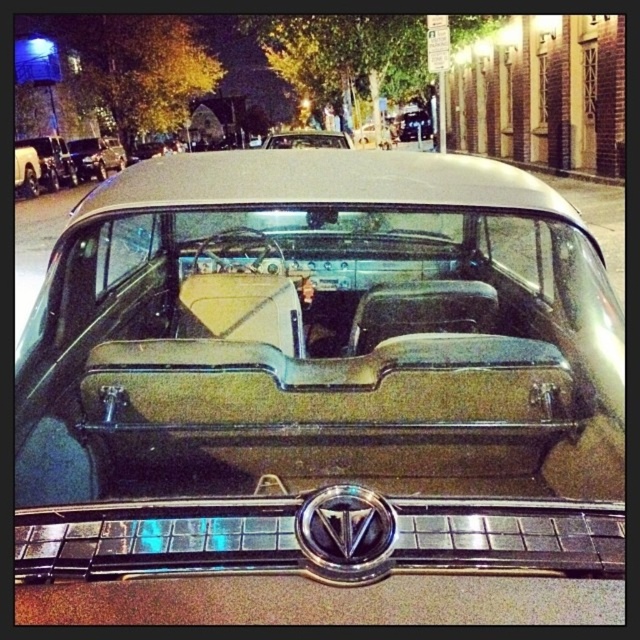
Question: Which of the following is the closest to the observer?

Choices:
 (A) (316, 145)
 (B) (310, 276)

Answer: (B)

Question: Where is metallic tan car at center located in relation to shiny beige leather car at center in the image?

Choices:
 (A) below
 (B) above

Answer: (A)

Question: Can you confirm if metallic tan car at center is positioned to the right of shiny beige leather car at center?

Choices:
 (A) yes
 (B) no

Answer: (A)

Question: Is metallic tan car at center bigger than shiny beige leather car at center?

Choices:
 (A) yes
 (B) no

Answer: (B)